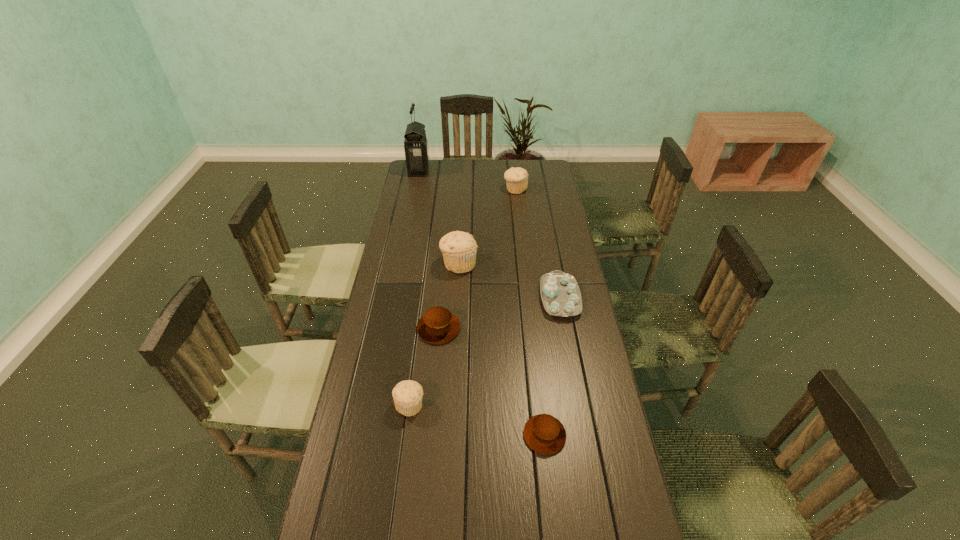
Where is `the bigger brown muffin`? The width and height of the screenshot is (960, 540). the bigger brown muffin is located at coordinates (438, 325).

Find the location of a particular element. The width and height of the screenshot is (960, 540). the shortest muffin is located at coordinates (543, 433).

Locate an element on the screen. The image size is (960, 540). the smaller brown muffin is located at coordinates (543, 433).

At what (x,y) coordinates should I click in order to perform the action: click on blank space located on the front-facing side of the leftmost object. Please return your answer as a coordinate pair (x, y). Image resolution: width=960 pixels, height=540 pixels. Looking at the image, I should click on (506, 170).

You are a GUI agent. You are given a task and a screenshot of the screen. Output one action in this format:
    pyautogui.click(x=<x>, y=<y>)
    Task: Click on the free space located on the right of the tallest muffin
    This screenshot has height=540, width=960.
    Given the screenshot: What is the action you would take?
    pyautogui.click(x=508, y=264)

Identify the location of vacant space located 0.080m on the back of the second farthest object. Image resolution: width=960 pixels, height=540 pixels. (514, 175).

Where is `vacant space located on the left of the blue chinaware`? This screenshot has width=960, height=540. vacant space located on the left of the blue chinaware is located at coordinates (448, 298).

The width and height of the screenshot is (960, 540). I want to click on vacant area situated 0.330m on the right of the smallest beige muffin, so click(537, 404).

Locate an element on the screen. free space located 0.370m on the back of the farther brown muffin is located at coordinates (445, 247).

The width and height of the screenshot is (960, 540). I want to click on vacant space situated on the front of the shortest muffin, so click(x=549, y=474).